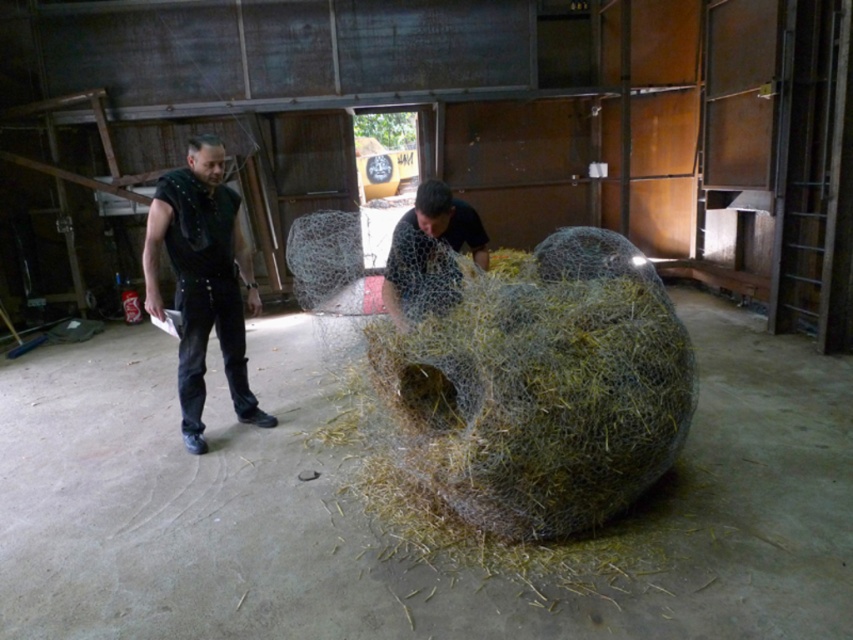
You are standing in the workshop and want to move from point A to point B. Point A is located at coordinate point (202, 355) and point B is at coordinate point (421, 230). Given that you can only move forward or backward along the z axis, which direction should you face to move from point A to point B?

To move from point A to point B, you should face backward along the z axis because point A is closer to you than point B, which is further away.

You are an artist working in the workshop and need to move the black studded leather vest at left to a higher position. Can you place it above the mesh fabric figure at center?

The black studded leather vest at left is currently below the mesh fabric figure at center. To place it above, you would need to move it to a position higher than the current location of the mesh fabric figure at center.

Based on the photo, you are an artist standing in the workshop and want to place a new sculpture. You see the point at (202, 280). What object is located at that point?

The point at (202, 280) is on the black studded leather vest at left.